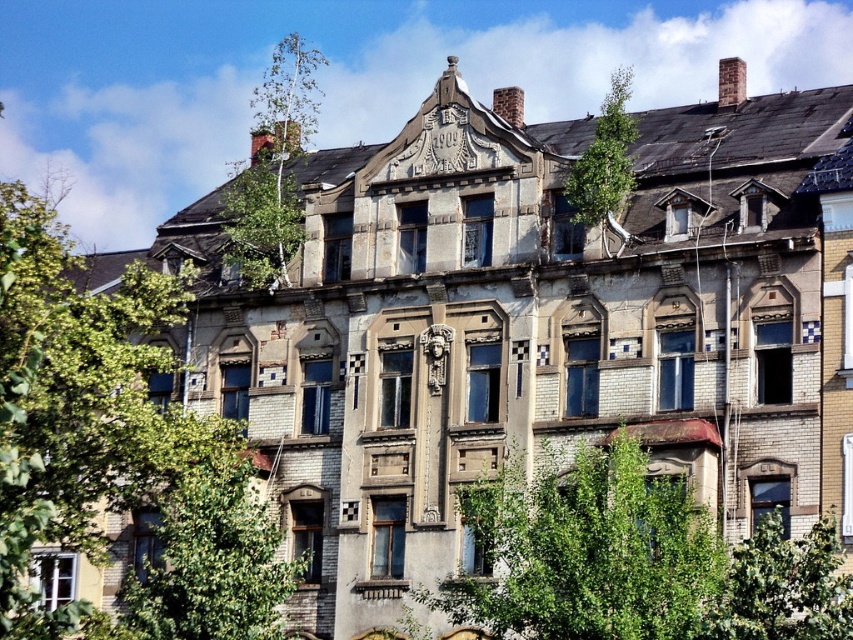
Consider the image. Who is more distant from viewer, [15,461] or [595,172]?

Positioned behind is point [595,172].

Is green leafy tree at upper left smaller than green leafy tree at upper right?

Correct, green leafy tree at upper left occupies less space than green leafy tree at upper right.

Image resolution: width=853 pixels, height=640 pixels. What do you see at coordinates (76, 403) in the screenshot? I see `green leafy tree at upper left` at bounding box center [76, 403].

This screenshot has height=640, width=853. What are the coordinates of `green leafy tree at upper left` in the screenshot? It's located at (76, 403).

Who is positioned more to the left, green leafy tree at upper left or green leafy tree at lower right?

From the viewer's perspective, green leafy tree at upper left appears more on the left side.

Locate an element on the screen. green leafy tree at upper left is located at coordinates pyautogui.click(x=76, y=403).

The width and height of the screenshot is (853, 640). What do you see at coordinates (782, 586) in the screenshot?
I see `green leafy tree at lower right` at bounding box center [782, 586].

Is point (764, 516) in front of point (567, 188)?

Yes, point (764, 516) is in front of point (567, 188).

Find the location of `green leafy tree at lower right`. green leafy tree at lower right is located at coordinates (782, 586).